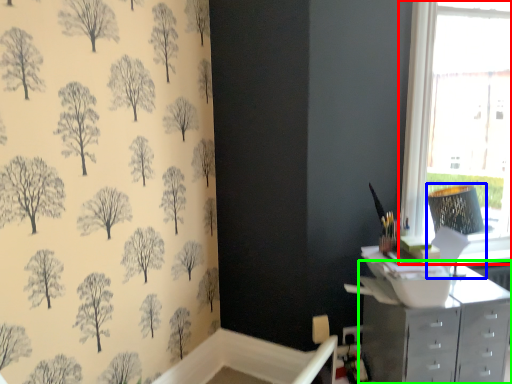
Question: Based on their relative distances, which object is farther from window (highlighted by a red box)? Choose from lamp (highlighted by a blue box) and chest of drawers (highlighted by a green box).

Choices:
 (A) lamp
 (B) chest of drawers

Answer: (B)